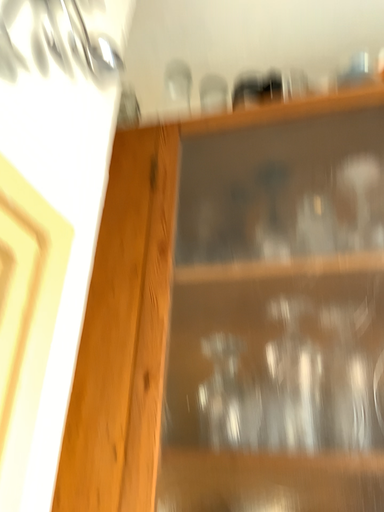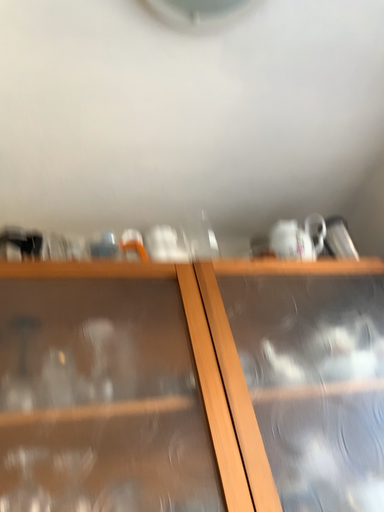
Question: Which way did the camera rotate in the video?

Choices:
 (A) rotated upward
 (B) rotated downward

Answer: (A)